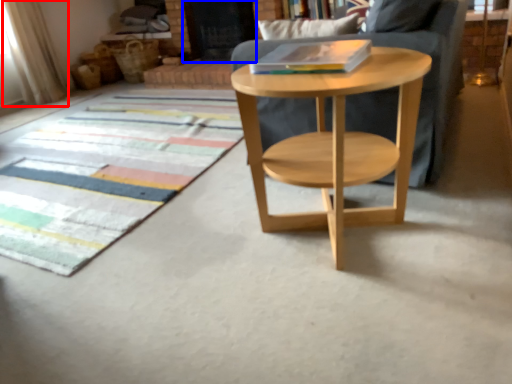
Question: Among these objects, which one is nearest to the camera, curtain (highlighted by a red box) or screen door (highlighted by a blue box)?

Choices:
 (A) curtain
 (B) screen door

Answer: (A)